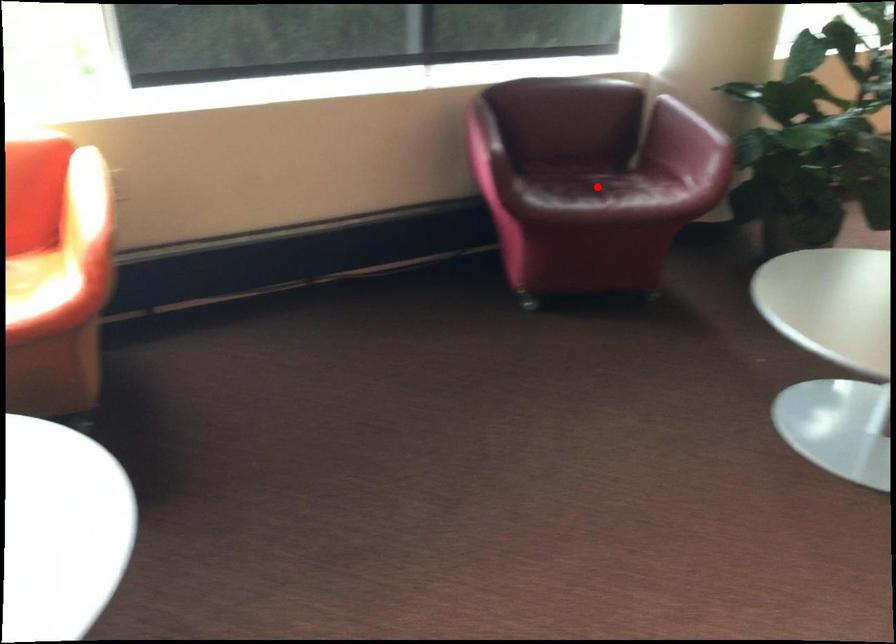
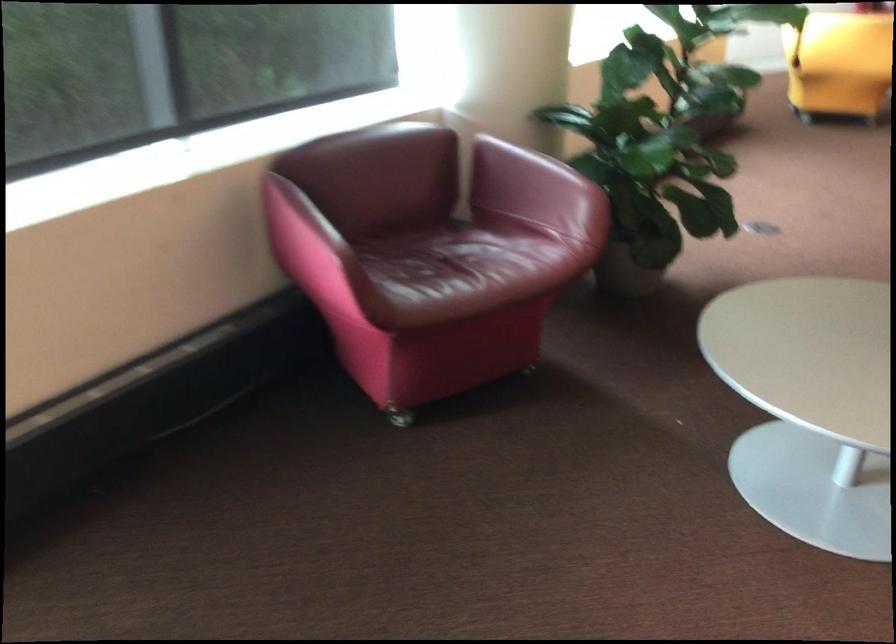
Locate, in the second image, the point that corresponds to the highlighted location in the first image.

(466, 266)